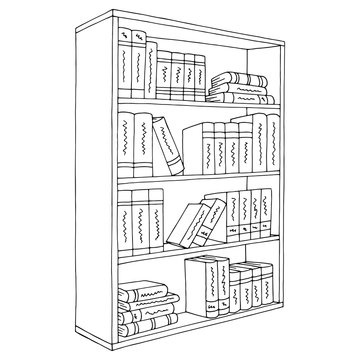
Find the location of a particular element. Image resolution: width=360 pixels, height=360 pixels. books on first shelf from the top is located at coordinates (123, 83), (137, 81), (146, 84), (160, 83), (176, 85), (190, 83), (196, 84), (236, 77), (237, 86), (237, 95).